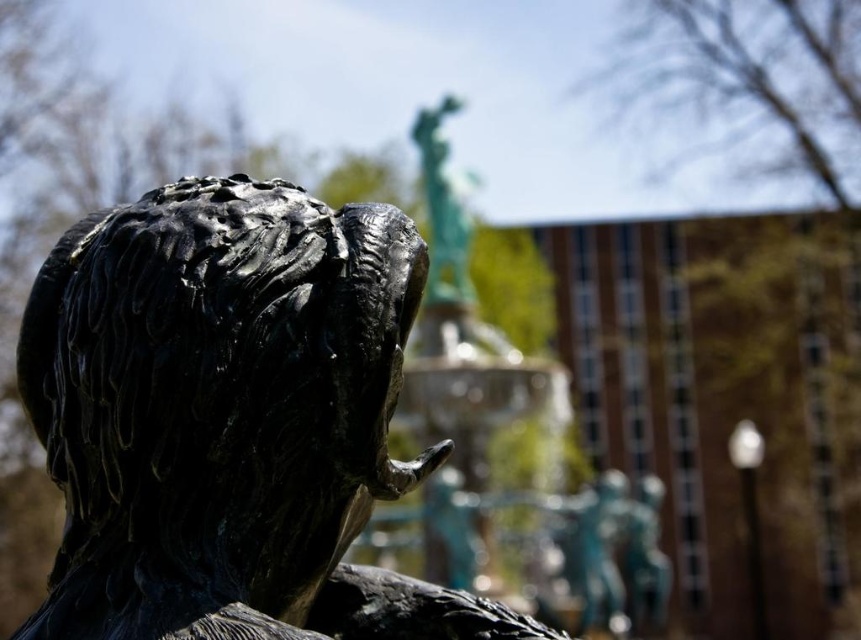
Is shiny black statue at center to the left of green patina statue at upper center from the viewer's perspective?

Indeed, shiny black statue at center is positioned on the left side of green patina statue at upper center.

This screenshot has height=640, width=861. What do you see at coordinates (230, 419) in the screenshot? I see `shiny black statue at center` at bounding box center [230, 419].

This screenshot has height=640, width=861. What do you see at coordinates (230, 419) in the screenshot? I see `shiny black statue at center` at bounding box center [230, 419].

In order to click on shiny black statue at center in this screenshot , I will do `click(230, 419)`.